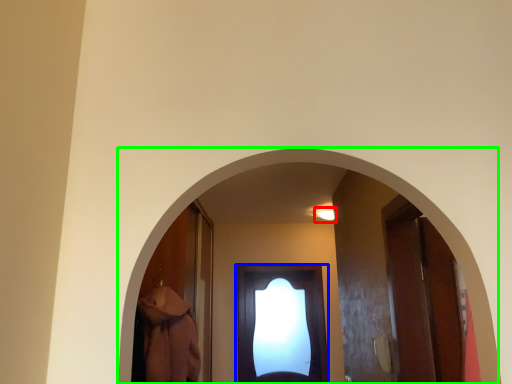
Question: Which object is positioned closest to light (highlighted by a red box)? Select from door (highlighted by a blue box) and archway (highlighted by a green box).

Choices:
 (A) door
 (B) archway

Answer: (A)